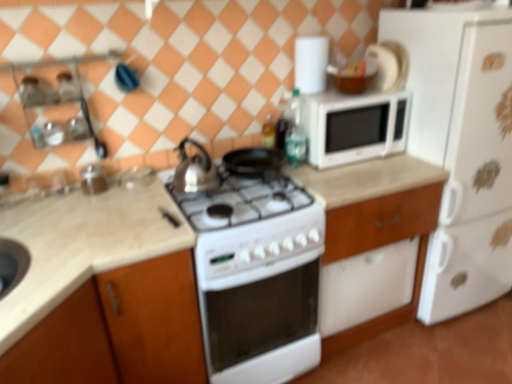
Locate an element on the screen. This screenshot has width=512, height=384. beige marble countertop at lower left, positioned as the 1th countertop in left-to-right order is located at coordinates (82, 245).

What do you see at coordinates (354, 126) in the screenshot?
I see `white matte microwave at upper center` at bounding box center [354, 126].

Describe the element at coordinates (462, 148) in the screenshot. I see `white matte refrigerator at right` at that location.

Identify the location of transparent glass jar at upper left, the 2th appliance from the top. 93,179.

Does point (309, 160) come farther from viewer compared to point (455, 263)?

No, it is in front of (455, 263).

From the image's perspective, does white matte microwave at upper center appear higher than white matte refrigerator at right?

Indeed, from the image's perspective, white matte microwave at upper center is shown above white matte refrigerator at right.

What's the angular difference between white matte microwave at upper center and white matte refrigerator at right's facing directions?

The angular difference between white matte microwave at upper center and white matte refrigerator at right is 0.000452 degrees.

Can you confirm if white matte microwave at upper center is wider than white matte refrigerator at right?

In fact, white matte microwave at upper center might be narrower than white matte refrigerator at right.

Does wooden cabinet at center have a lesser height compared to white glossy stove at center?

Indeed, wooden cabinet at center has a lesser height compared to white glossy stove at center.

How many degrees apart are the facing directions of wooden cabinet at center and white glossy stove at center?

The angular difference between wooden cabinet at center and white glossy stove at center is 4.56e-05 degrees.

In the scene shown: Does wooden cabinet at center appear on the left side of white glossy stove at center?

No, wooden cabinet at center is not to the left of white glossy stove at center.

Is wooden cabinet at center completely or partially outside of white glossy stove at center?

Yes, wooden cabinet at center is located beyond the bounds of white glossy stove at center.

From a real-world perspective, which is physically above, white glossy stove at center or beige marble countertop at center, the 2th countertop from the left?

beige marble countertop at center, the 2th countertop from the left, from a real-world perspective.

Between white glossy stove at center and beige marble countertop at center, the 2th countertop from the left, which one is positioned behind?

white glossy stove at center.

Is point (314, 225) closer or farther from the camera than point (113, 217)?

Point (314, 225).

Would you say white glossy stove at center contains beige marble countertop at center, the 2th countertop from the left?

No, white glossy stove at center does not contain beige marble countertop at center, the 2th countertop from the left.

From the image's perspective, relative to translucent glass bottle at upper center, which is the 1th bottle from left to right, is wooden cabinet at center above or below?

From the image's perspective, wooden cabinet at center appears below translucent glass bottle at upper center, which is the 1th bottle from left to right.

Is wooden cabinet at center with translucent glass bottle at upper center, acting as the second bottle starting from the right?

No, wooden cabinet at center is not in contact with translucent glass bottle at upper center, acting as the second bottle starting from the right.

From a real-world perspective, does white glossy stove at center sit lower than silver metallic kettle at center?

Yes, from a real-world perspective, white glossy stove at center is below silver metallic kettle at center.

What's the angular difference between white glossy stove at center and silver metallic kettle at center's facing directions?

The facing directions of white glossy stove at center and silver metallic kettle at center are 0.000209 degrees apart.

Which of these two, white glossy stove at center or silver metallic kettle at center, is thinner?

silver metallic kettle at center.

This screenshot has height=384, width=512. Find the location of `kitchen appliance on the left side of white glossy stove at center`. kitchen appliance on the left side of white glossy stove at center is located at coordinates (194, 171).

How many degrees apart are the facing directions of white glossy stove at center and white glossy microwave at upper right, which is counted as the 2th appliance, starting from the bottom?

The facing directions of white glossy stove at center and white glossy microwave at upper right, which is counted as the 2th appliance, starting from the bottom, are 1.18 degrees apart.

Would you say white glossy stove at center is inside or outside white glossy microwave at upper right, the 1th appliance in the back-to-front sequence?

white glossy stove at center is outside white glossy microwave at upper right, the 1th appliance in the back-to-front sequence.

Is white glossy stove at center looking in the opposite direction of white glossy microwave at upper right, which ranks as the second appliance in left-to-right order?

No, white glossy microwave at upper right, which ranks as the second appliance in left-to-right order, is not at the back of white glossy stove at center.

Is green glass bottle at upper right, acting as the first bottle starting from the right, in contact with wooden cabinet at center?

green glass bottle at upper right, acting as the first bottle starting from the right, and wooden cabinet at center are clearly separated.

In the scene shown: Is green glass bottle at upper right, marked as the second bottle in a left-to-right arrangement, taller or shorter than wooden cabinet at center?

Considering their sizes, green glass bottle at upper right, marked as the second bottle in a left-to-right arrangement, has less height than wooden cabinet at center.

How much distance is there between green glass bottle at upper right, marked as the second bottle in a left-to-right arrangement, and wooden cabinet at center?

green glass bottle at upper right, marked as the second bottle in a left-to-right arrangement, is 22.92 inches from wooden cabinet at center.

Which object is positioned more to the left, green glass bottle at upper right, acting as the first bottle starting from the right, or wooden cabinet at center?

From the viewer's perspective, green glass bottle at upper right, acting as the first bottle starting from the right, appears more on the left side.

Where is `microwave oven above the white matte refrigerator at right (from a real-world perspective)`? Image resolution: width=512 pixels, height=384 pixels. microwave oven above the white matte refrigerator at right (from a real-world perspective) is located at coordinates (354, 126).

The width and height of the screenshot is (512, 384). I want to click on home appliance lying on the left of wooden cabinet at center, so click(x=258, y=280).

Which object lies further to the anchor point beige marble countertop at lower left, positioned as the 1th countertop in left-to-right order, beige marble countertop at center, which is the first countertop in right-to-left order, or translucent glass bottle at upper center, acting as the second bottle starting from the right?

translucent glass bottle at upper center, acting as the second bottle starting from the right, is further to beige marble countertop at lower left, positioned as the 1th countertop in left-to-right order.

When comparing their distances from white matte refrigerator at right, does beige marble countertop at center, the 2th countertop from the left, or wooden cabinet at center seem closer?

The object closer to white matte refrigerator at right is wooden cabinet at center.

Estimate the real-world distances between objects in this image. Which object is closer to white matte microwave at upper center, white glossy microwave at upper right, the 1th appliance in the back-to-front sequence, or silver metallic kettle at center?

white glossy microwave at upper right, the 1th appliance in the back-to-front sequence, is positioned closer to the anchor white matte microwave at upper center.

When comparing their distances from green glass bottle at upper right, marked as the second bottle in a left-to-right arrangement, does silver metallic kettle at center or white glossy microwave at upper right, which ranks as the second appliance in left-to-right order, seem closer?

Among the two, white glossy microwave at upper right, which ranks as the second appliance in left-to-right order, is located nearer to green glass bottle at upper right, marked as the second bottle in a left-to-right arrangement.

Looking at the image, which one is located closer to wooden cabinet at center, beige marble countertop at center, which is the first countertop in right-to-left order, or beige marble countertop at lower left, which is the 2th countertop from right to left?

beige marble countertop at center, which is the first countertop in right-to-left order, is positioned closer to the anchor wooden cabinet at center.

Looking at the image, which one is located closer to white matte microwave at upper center, white glossy stove at center or white glossy microwave at upper right, which ranks as the second appliance in left-to-right order?

white glossy microwave at upper right, which ranks as the second appliance in left-to-right order.

When comparing their distances from white matte refrigerator at right, does green glass bottle at upper right, acting as the first bottle starting from the right, or beige marble countertop at center, the 2th countertop from the left, seem further?

Based on the image, beige marble countertop at center, the 2th countertop from the left, appears to be further to white matte refrigerator at right.

Looking at the image, which one is located further to white matte microwave at upper center, beige marble countertop at center, which is the first countertop in right-to-left order, or beige marble countertop at lower left, which is the 2th countertop from right to left?

beige marble countertop at lower left, which is the 2th countertop from right to left.

Image resolution: width=512 pixels, height=384 pixels. What are the coordinates of `microwave oven situated between silver metallic kettle at center and wooden cabinet at center from left to right` in the screenshot? It's located at (354, 126).

Where is `kitchen appliance between beige marble countertop at center, the 2th countertop from the left, and white matte microwave at upper center in the front-back direction`? The image size is (512, 384). kitchen appliance between beige marble countertop at center, the 2th countertop from the left, and white matte microwave at upper center in the front-back direction is located at coordinates (194, 171).

This screenshot has width=512, height=384. Find the location of `bottle between translucent glass bottle at upper center, which is the 1th bottle from left to right, and white glossy microwave at upper right, arranged as the second appliance when viewed from the front`. bottle between translucent glass bottle at upper center, which is the 1th bottle from left to right, and white glossy microwave at upper right, arranged as the second appliance when viewed from the front is located at coordinates (296, 132).

At what (x,y) coordinates should I click in order to perform the action: click on microwave oven located between translucent glass bottle at upper center, which is the 1th bottle from left to right, and white glossy microwave at upper right, which ranks as the second appliance in left-to-right order, in the left-right direction. Please return your answer as a coordinate pair (x, y). The width and height of the screenshot is (512, 384). Looking at the image, I should click on (354, 126).